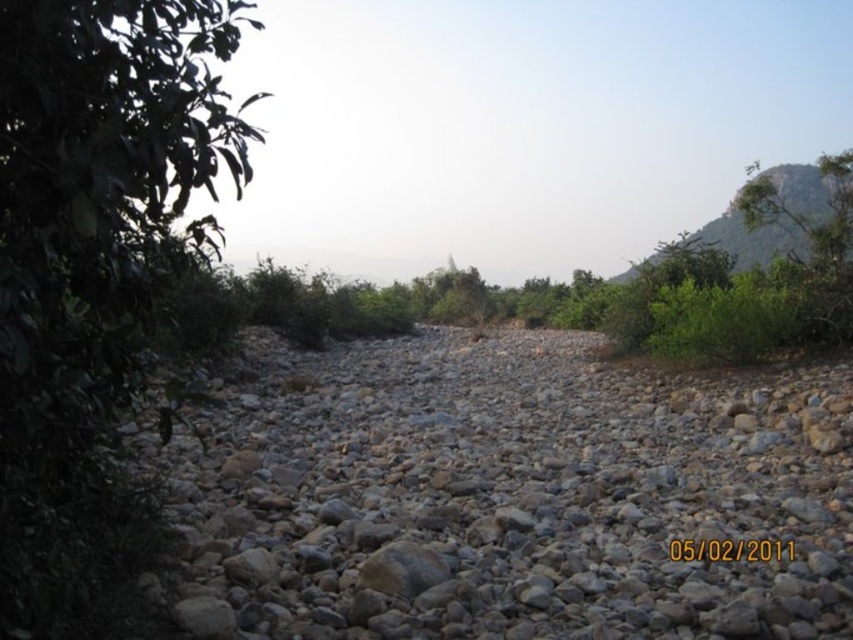
Question: Which of the following is the farthest from the observer?

Choices:
 (A) gray rough gravel at center
 (B) green leafy tree at upper right
 (C) green leafy tree at left

Answer: (B)

Question: Estimate the real-world distances between objects in this image. Which object is closer to the gray rough gravel at center?

Choices:
 (A) green leafy tree at left
 (B) green leafy tree at upper right

Answer: (A)

Question: Is green leafy tree at left behind green leafy tree at upper right?

Choices:
 (A) yes
 (B) no

Answer: (B)

Question: Is green leafy tree at left to the right of green leafy tree at upper right from the viewer's perspective?

Choices:
 (A) yes
 (B) no

Answer: (B)

Question: Is gray rough gravel at center positioned at the back of green leafy tree at upper right?

Choices:
 (A) no
 (B) yes

Answer: (A)

Question: Estimate the real-world distances between objects in this image. Which object is closer to the green leafy tree at upper right?

Choices:
 (A) gray rough gravel at center
 (B) green leafy tree at left

Answer: (A)